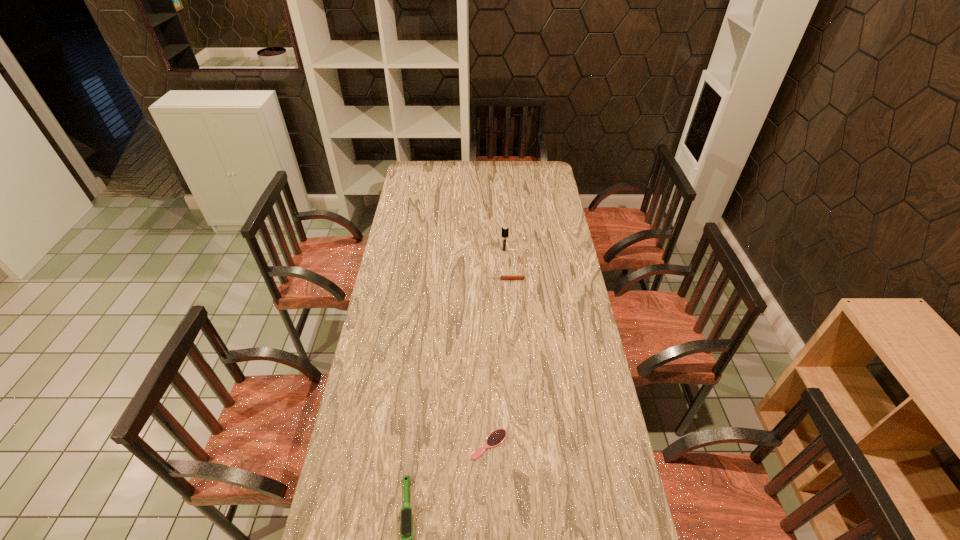
Identify which object is the third closest to the farthest object. Please provide its 2D coordinates. Your answer should be formatted as a tuple, i.e. [(x, y)], where the tuple contains the x and y coordinates of a point satisfying the conditions above.

[(406, 523)]

Locate an element on the screen. Image resolution: width=960 pixels, height=540 pixels. object that ranks as the third closest to the leftmost hairbrush is located at coordinates (505, 230).

The width and height of the screenshot is (960, 540). Find the location of `the second closest hairbrush to the sausage`. the second closest hairbrush to the sausage is located at coordinates (497, 437).

The height and width of the screenshot is (540, 960). Identify the location of the closest hairbrush to the tallest object. (497, 437).

Identify the location of vacant area in the image that satisfies the following two spatial constraints: 1. on the back side of the shortest object; 2. on the left side of the sausage. (487, 279).

Find the location of a particular element. vacant space that satisfies the following two spatial constraints: 1. on the back side of the third nearest object; 2. on the left side of the shortest hairbrush is located at coordinates (487, 279).

This screenshot has width=960, height=540. Find the location of `free space that satisfies the following two spatial constraints: 1. on the back side of the shortest hairbrush; 2. on the left side of the third nearest object`. free space that satisfies the following two spatial constraints: 1. on the back side of the shortest hairbrush; 2. on the left side of the third nearest object is located at coordinates (487, 279).